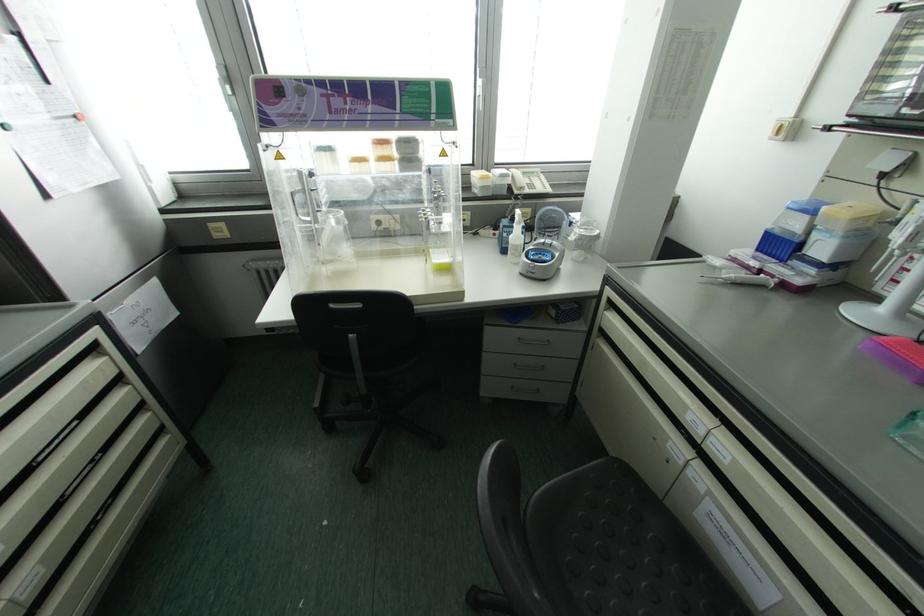
Find where to turn the white machine dial. Please return your answer as a coordinate pair (x, y).

(544, 257)